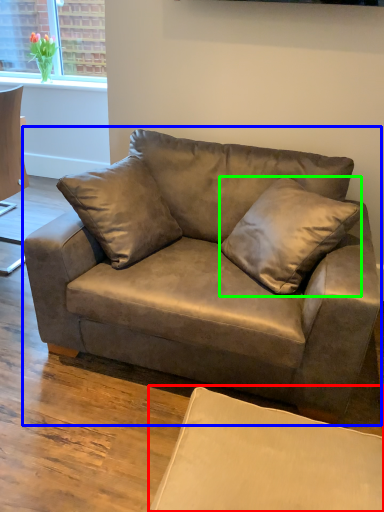
Question: Considering the real-world distances, which object is closest to swivel chair (highlighted by a red box)? studio couch (highlighted by a blue box) or pillow (highlighted by a green box).

Choices:
 (A) studio couch
 (B) pillow

Answer: (A)